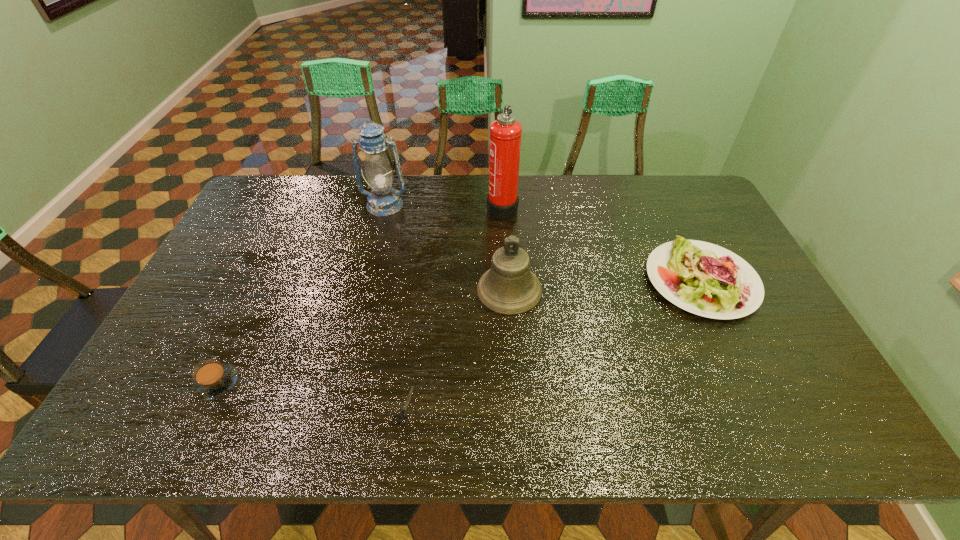
You are a GUI agent. You are given a task and a screenshot of the screen. Output one action in this format:
    pyautogui.click(x=<x>, y=<y>)
    Task: Click on the tallest object
    The width and height of the screenshot is (960, 540).
    Given the screenshot: What is the action you would take?
    pyautogui.click(x=505, y=135)

Locate an element on the screen. This screenshot has width=960, height=540. lantern is located at coordinates (383, 200).

What are the coordinates of `the second object from left to right` in the screenshot? It's located at [383, 200].

At what (x,y) coordinates should I click in order to perform the action: click on the third tallest object. Please return your answer as a coordinate pair (x, y). This screenshot has height=540, width=960. Looking at the image, I should click on (509, 287).

Identify the location of the rightmost object. This screenshot has width=960, height=540. (705, 279).

The width and height of the screenshot is (960, 540). In order to click on salad plate in this screenshot , I will do `click(705, 279)`.

Locate an element on the screen. cappuccino is located at coordinates (212, 379).

Find the location of `the leftmost object`. the leftmost object is located at coordinates (x=212, y=379).

Locate an element on the screen. the shortest object is located at coordinates (402, 415).

This screenshot has width=960, height=540. I want to click on shears, so click(x=402, y=415).